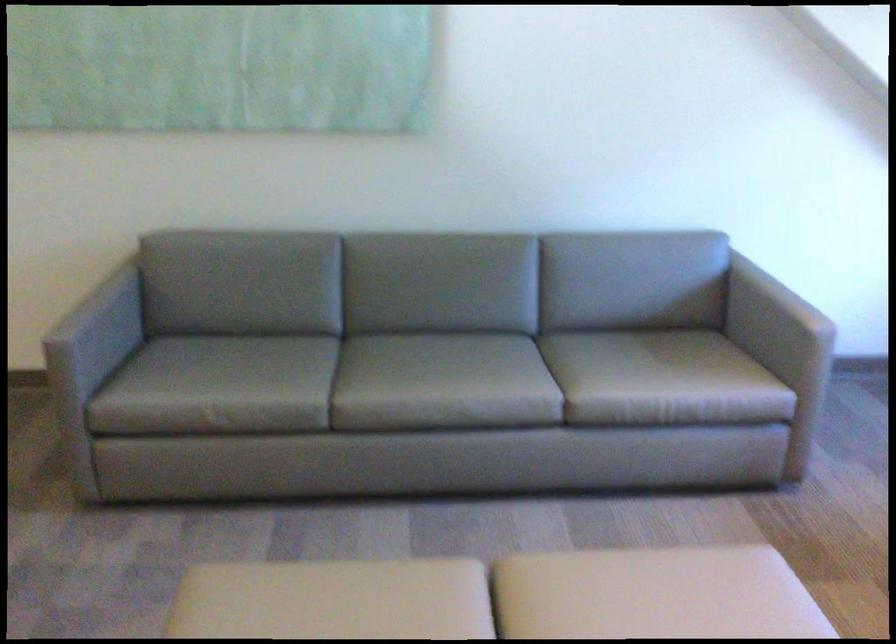
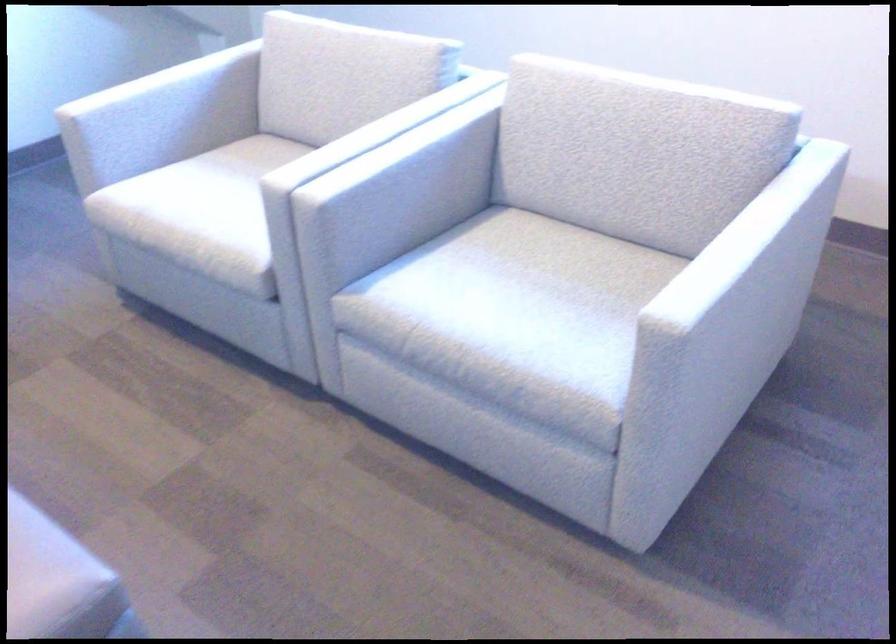
How did the camera likely rotate?

The rotation direction of the camera is right-down.